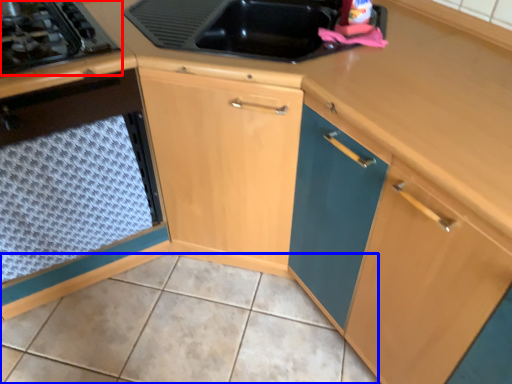
Question: Which object appears farthest to the camera in this image, gas stove (highlighted by a red box) or tile (highlighted by a blue box)?

Choices:
 (A) gas stove
 (B) tile

Answer: (A)